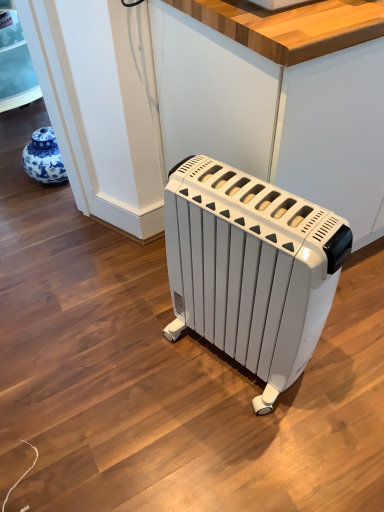
Find the location of a particular element. Image resolution: width=384 pixels, height=512 pixels. free point to the left of white plastic radiator at center is located at coordinates coord(142,362).